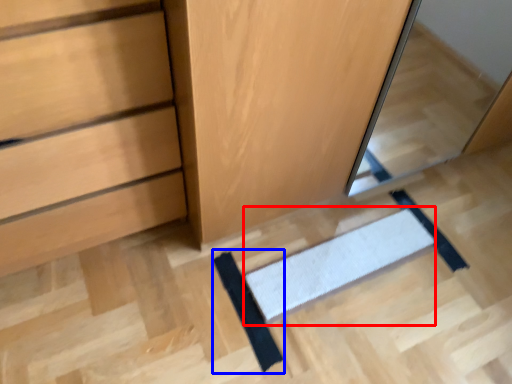
Question: Which of the following is the closest to the observer, doormat (highlighted by a red box) or doormat (highlighted by a blue box)?

Choices:
 (A) doormat
 (B) doormat

Answer: (B)